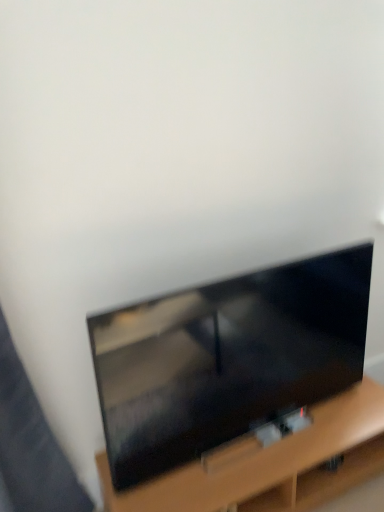
You are a GUI agent. You are given a task and a screenshot of the screen. Output one action in this format:
    pyautogui.click(x=<x>, y=<y>)
    Task: Click on the matte black tv at center
    Image resolution: width=384 pixels, height=512 pixels.
    Given the screenshot: What is the action you would take?
    pyautogui.click(x=226, y=359)

Describe the element at coordinates (226, 359) in the screenshot. The image size is (384, 512). I see `matte black tv at center` at that location.

Measure the distance between matte black tv at center and camera.

matte black tv at center and camera are 1.17 meters apart.

What is the approximate width of wooden tv stand at lower center?

wooden tv stand at lower center is 16.42 inches wide.

Image resolution: width=384 pixels, height=512 pixels. Describe the element at coordinates (272, 465) in the screenshot. I see `wooden tv stand at lower center` at that location.

In order to click on wooden tv stand at lower center in this screenshot , I will do `click(272, 465)`.

Where is `matte black tv at center`? matte black tv at center is located at coordinates tap(226, 359).

Considering the relative positions of wooden tv stand at lower center and matte black tv at center in the image provided, is wooden tv stand at lower center to the left of matte black tv at center from the viewer's perspective?

In fact, wooden tv stand at lower center is to the right of matte black tv at center.

Does wooden tv stand at lower center lie in front of matte black tv at center?

No, the depth of wooden tv stand at lower center is greater than that of matte black tv at center.

Which point is more distant from viewer, [326,404] or [250,414]?

The point [326,404] is more distant.

From the image's perspective, is wooden tv stand at lower center above matte black tv at center?

Actually, wooden tv stand at lower center appears below matte black tv at center in the image.

From a real-world perspective, who is located higher, wooden tv stand at lower center or matte black tv at center?

matte black tv at center, from a real-world perspective.

Which of these two, wooden tv stand at lower center or matte black tv at center, is thinner?

With smaller width is matte black tv at center.

In terms of height, does wooden tv stand at lower center look taller or shorter compared to matte black tv at center?

wooden tv stand at lower center is shorter than matte black tv at center.

Which of these two, wooden tv stand at lower center or matte black tv at center, is smaller?

With smaller size is matte black tv at center.

Is wooden tv stand at lower center not inside matte black tv at center?

Yes, wooden tv stand at lower center is located beyond the bounds of matte black tv at center.

Are wooden tv stand at lower center and matte black tv at center located far from each other?

wooden tv stand at lower center is near matte black tv at center, not far away.

Is wooden tv stand at lower center oriented towards matte black tv at center?

No.

Looking at this image, how far apart are wooden tv stand at lower center and matte black tv at center?

A distance of 10.76 inches exists between wooden tv stand at lower center and matte black tv at center.

You are a GUI agent. You are given a task and a screenshot of the screen. Output one action in this format:
    pyautogui.click(x=<x>, y=<y>)
    Task: Click on the furniture below the matte black tv at center (from a real-world perspective)
    
    Given the screenshot: What is the action you would take?
    pyautogui.click(x=272, y=465)

Between matte black tv at center and wooden tv stand at lower center, which one appears on the right side from the viewer's perspective?

wooden tv stand at lower center is more to the right.

Does matte black tv at center lie in front of wooden tv stand at lower center?

Yes, matte black tv at center is closer to the viewer.

Which is farther from the camera, (317,342) or (157,495)?

The point (317,342) is farther from the camera.

From the image's perspective, which one is positioned lower, matte black tv at center or wooden tv stand at lower center?

wooden tv stand at lower center, from the image's perspective.

From a real-world perspective, does matte black tv at center sit lower than wooden tv stand at lower center?

No, from a real-world perspective, matte black tv at center is not beneath wooden tv stand at lower center.

Considering the sizes of matte black tv at center and wooden tv stand at lower center in the image, is matte black tv at center wider or thinner than wooden tv stand at lower center?

In the image, matte black tv at center appears to be more narrow than wooden tv stand at lower center.

Who is shorter, matte black tv at center or wooden tv stand at lower center?

Standing shorter between the two is wooden tv stand at lower center.

Between matte black tv at center and wooden tv stand at lower center, which one has larger size?

wooden tv stand at lower center is bigger.

Based on the photo, would you say wooden tv stand at lower center is part of matte black tv at center's contents?

No, wooden tv stand at lower center is not surrounded by matte black tv at center.

Are matte black tv at center and wooden tv stand at lower center located far from each other?

matte black tv at center is near wooden tv stand at lower center, not far away.

Consider the image. Could you tell me if matte black tv at center is facing wooden tv stand at lower center?

No, matte black tv at center is not aimed at wooden tv stand at lower center.

At what (x,y) coordinates should I click in order to perform the action: click on furniture lying behind the matte black tv at center. Please return your answer as a coordinate pair (x, y). The height and width of the screenshot is (512, 384). Looking at the image, I should click on (272, 465).

Where is `furniture located below the matte black tv at center (from the image's perspective)`? This screenshot has width=384, height=512. furniture located below the matte black tv at center (from the image's perspective) is located at coordinates (272, 465).

Where is `furniture below the matte black tv at center (from a real-world perspective)`? This screenshot has width=384, height=512. furniture below the matte black tv at center (from a real-world perspective) is located at coordinates (272, 465).